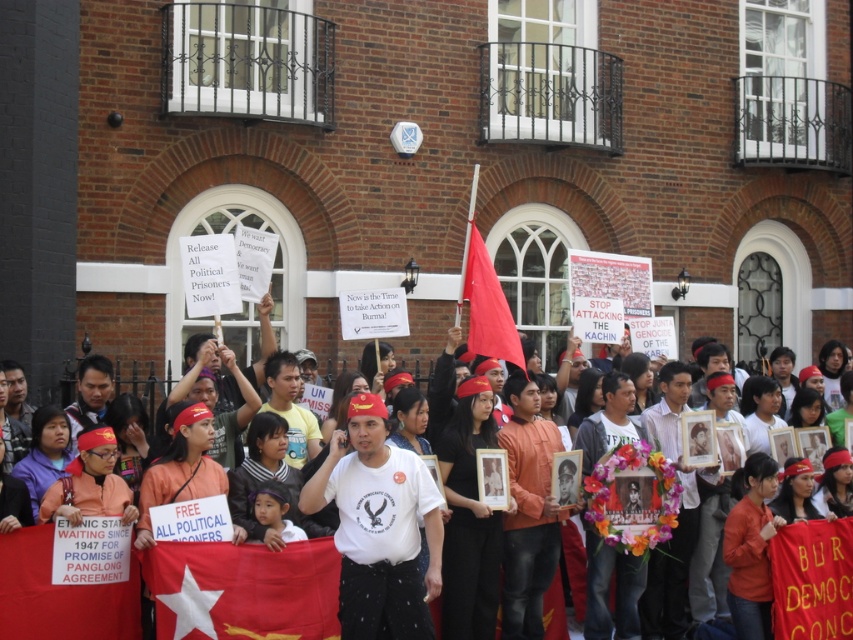
Is white cotton t-shirt at center positioned in front of matte red flag at center?

Yes, it is.

Is point (338, 449) positioned before point (486, 268)?

That is True.

This screenshot has height=640, width=853. Describe the element at coordinates (378, 528) in the screenshot. I see `white cotton t-shirt at center` at that location.

Find the location of a particular element. This screenshot has width=853, height=640. white cotton t-shirt at center is located at coordinates coord(378,528).

Is point (808, 579) positioned behind point (230, 544)?

Yes, it is behind point (230, 544).

Where is `white cotton shirt at center`? This screenshot has height=640, width=853. white cotton shirt at center is located at coordinates (172, 592).

Is point (142, 563) in front of point (155, 609)?

Yes, it is in front of point (155, 609).

Where is `white cotton shirt at center`? The image size is (853, 640). white cotton shirt at center is located at coordinates (172, 592).

Does white cotton shirt at center appear under white cotton t-shirt at center?

Yes.

Who is positioned more to the left, white cotton shirt at center or white cotton t-shirt at center?

white cotton t-shirt at center

Does point (38, 608) come farther from viewer compared to point (346, 636)?

That is False.

In order to click on white cotton shirt at center in this screenshot , I will do `click(172, 592)`.